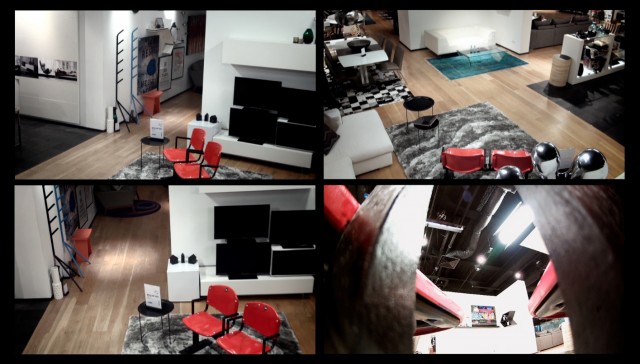
You are a GUI agent. You are given a task and a screenshot of the screen. Output one action in this format:
    pyautogui.click(x=<x>, y=<y>)
    Task: Click on the white wall
    
    Given the screenshot: What is the action you would take?
    pyautogui.click(x=218, y=23)